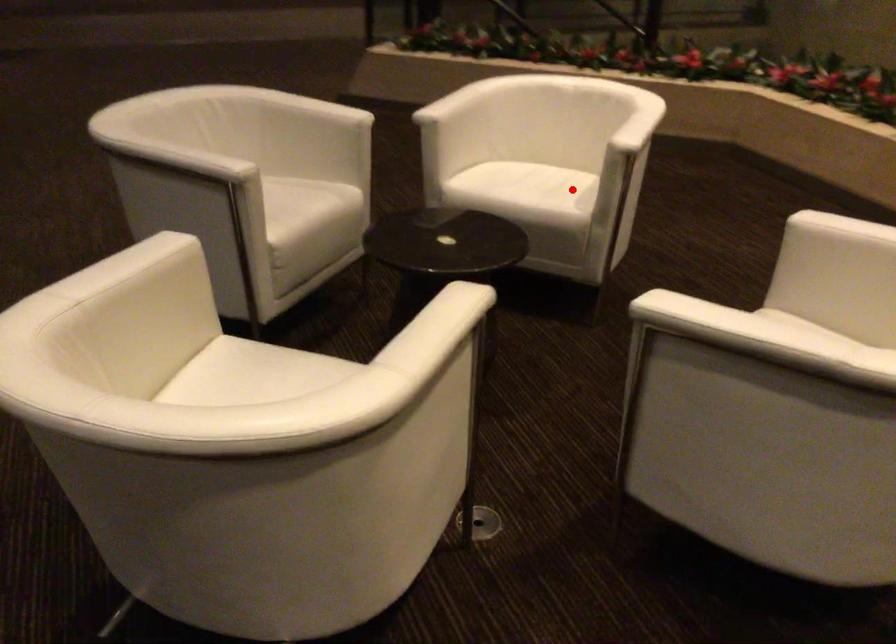
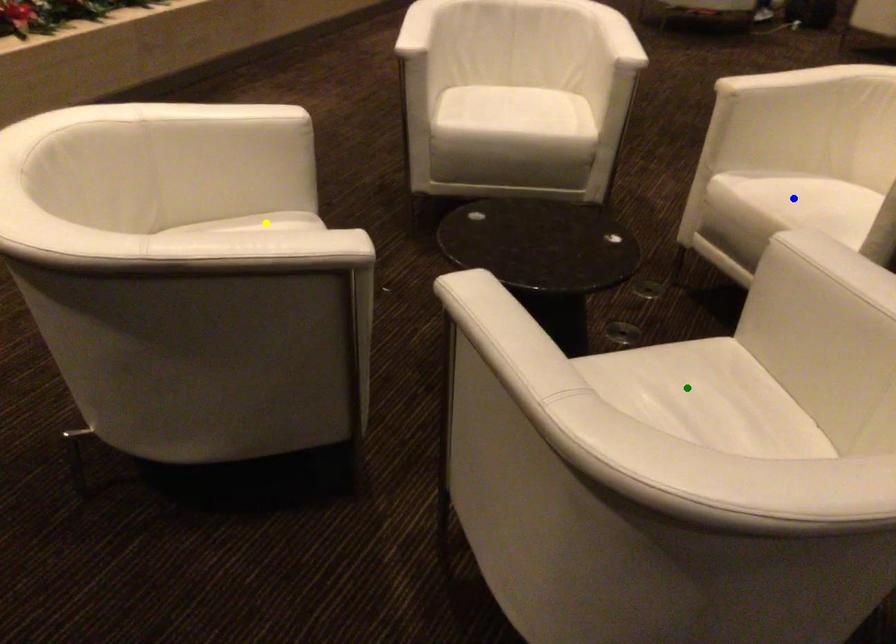
Question: I am providing you with two images of the same scene from different viewpoints. A red point is marked on the first image. You are given multiple points on the second image. Can you choose the point in image 2 that corresponds to the point in image 1?

Choices:
 (A) green point
 (B) blue point
 (C) yellow point

Answer: (C)